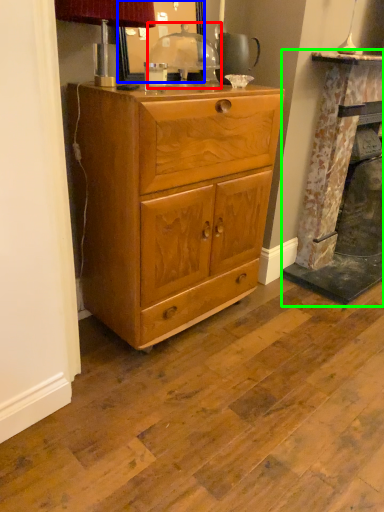
Question: Based on their relative distances, which object is farther from table lamp (highlighted by a red box)? Choose from mirror (highlighted by a blue box) and fireplace (highlighted by a green box).

Choices:
 (A) mirror
 (B) fireplace

Answer: (B)